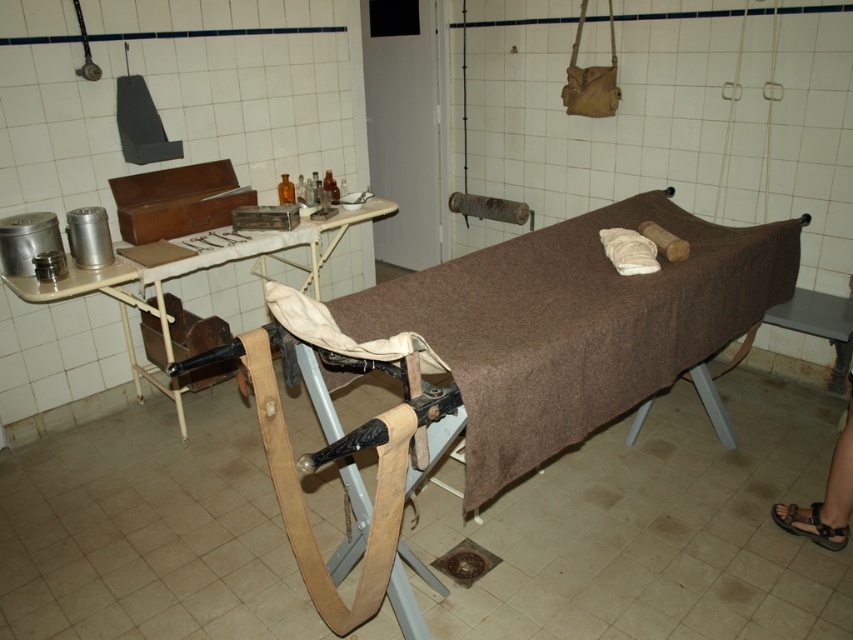
You are a nurse in this historical medical setting. You need to place a new medical kit on the brown fabric bed at center without it falling off. Where should you place the kit on the bed relative to the metallic silver tray at upper left?

The brown fabric bed at center is positioned under the metallic silver tray at upper left, so placing the medical kit on the bed directly below the tray would ensure it stays secure and won not fall off.

You are a medical student observing the vintage medical setup. You need to place a new medical kit on the surface that can accommodate its size. Which object between the brown fabric bed at center and the metallic silver tray at upper left would be more suitable for placing the kit?

The brown fabric bed at center has a larger size compared to the metallic silver tray at upper left, so the brown fabric bed at center would be more suitable for placing the kit as it can accommodate the kit better due to its larger surface area.

You are a medical student in a historical medical setting. You need to place a medical textbook on the brown fabric bed at center. Where exactly should you place it?

The brown fabric bed at center is located at point (576, 328), so you should place the medical textbook there.